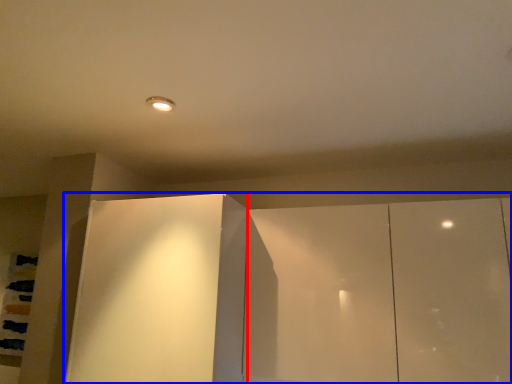
Question: Which point is closer to the camera, glass door (highlighted by a red box) or cupboard (highlighted by a blue box)?

Choices:
 (A) glass door
 (B) cupboard

Answer: (B)